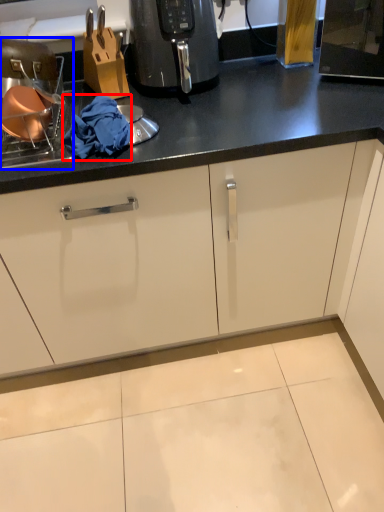
Question: Which of the following is the closest to the observer, material (highlighted by a red box) or appliance (highlighted by a blue box)?

Choices:
 (A) material
 (B) appliance

Answer: (B)